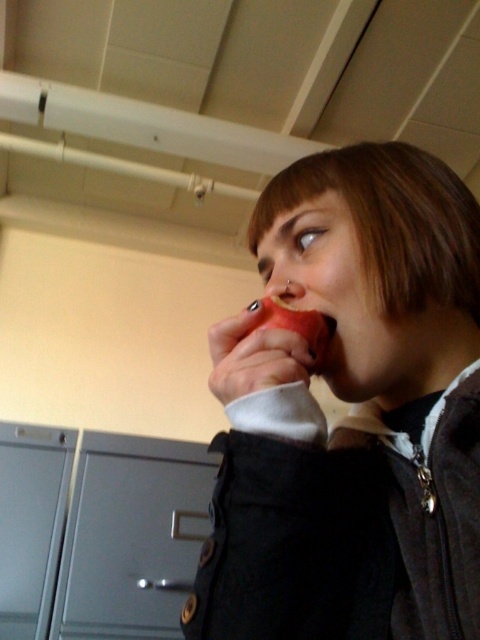
Looking at this image, does red matte apple at mouth have a lesser width compared to matte flesh-colored nose at center?

No, red matte apple at mouth is not thinner than matte flesh-colored nose at center.

Find the location of a particular element. This screenshot has height=640, width=480. red matte apple at mouth is located at coordinates (299, 326).

Does point (298, 323) lie in front of point (286, 289)?

Yes, it is.

Where is `red matte apple at mouth`? This screenshot has width=480, height=640. red matte apple at mouth is located at coordinates (299, 326).

Does gray matte/file cabinet at lower left have a lesser width compared to red matte apple at mouth?

No, gray matte/file cabinet at lower left is not thinner than red matte apple at mouth.

Between gray matte/file cabinet at lower left and red matte apple at mouth, which one has more height?

Standing taller between the two is gray matte/file cabinet at lower left.

Measure the distance between gray matte/file cabinet at lower left and camera.

gray matte/file cabinet at lower left and camera are 4.02 feet apart.

In order to click on gray matte/file cabinet at lower left in this screenshot , I will do `click(132, 536)`.

Does gray matte/file cabinet at lower left appear on the right side of matte flesh-colored nose at center?

In fact, gray matte/file cabinet at lower left is to the left of matte flesh-colored nose at center.

Does gray matte/file cabinet at lower left have a smaller size compared to matte flesh-colored nose at center?

No.

Which is behind, point (160, 593) or point (296, 298)?

Positioned behind is point (160, 593).

Where is `gray matte/file cabinet at lower left`? The image size is (480, 640). gray matte/file cabinet at lower left is located at coordinates (132, 536).